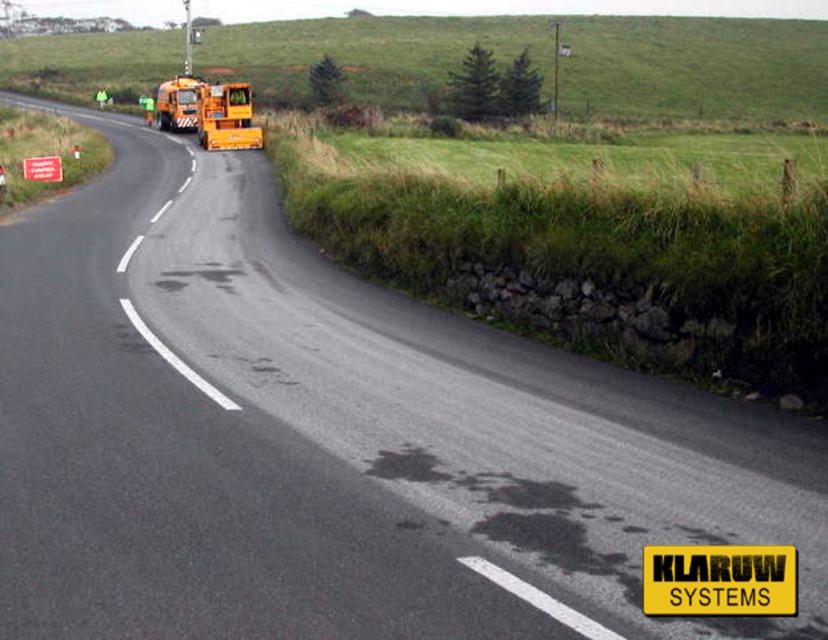
Question: Which point is farther to the camera?

Choices:
 (A) (212, 88)
 (B) (167, 81)

Answer: (B)

Question: Which object is closer to the camera taking this photo?

Choices:
 (A) yellow metallic school bus at upper left
 (B) orange metallic truck at upper left

Answer: (A)

Question: Can you confirm if yellow metallic school bus at upper left is wider than orange metallic truck at upper left?

Choices:
 (A) yes
 (B) no

Answer: (B)

Question: Does yellow metallic school bus at upper left have a larger size compared to orange metallic truck at upper left?

Choices:
 (A) yes
 (B) no

Answer: (B)

Question: Does yellow metallic school bus at upper left lie in front of orange metallic truck at upper left?

Choices:
 (A) yes
 (B) no

Answer: (A)